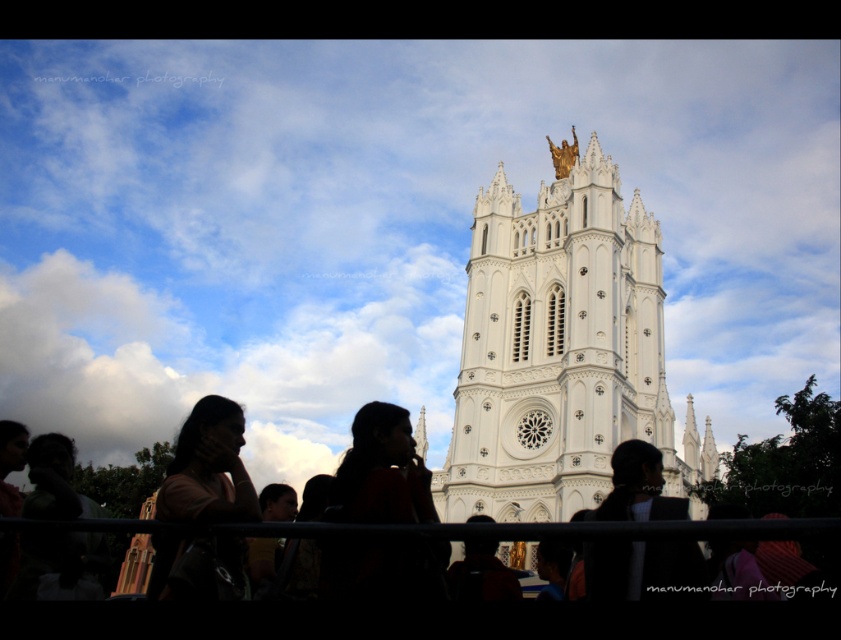
Question: Which point is closer to the camera?

Choices:
 (A) white stone tower at center
 (B) matte pink shirt at lower left
 (C) white stone spire at center

Answer: (B)

Question: Which point is closer to the camera taking this photo?

Choices:
 (A) click(x=56, y=470)
 (B) click(x=580, y=400)
 (C) click(x=218, y=467)

Answer: (C)

Question: Does matte pink shirt at lower left have a larger size compared to white stone spire at center?

Choices:
 (A) yes
 (B) no

Answer: (A)

Question: Which point is farther to the camera?

Choices:
 (A) dark brown leather backpack at center
 (B) dark red fabric at center
 (C) black fabric at center

Answer: (A)

Question: Is dark red fabric at center positioned before black fabric at center?

Choices:
 (A) yes
 (B) no

Answer: (B)

Question: Is white stone tower at center positioned behind matte pink shirt at lower left?

Choices:
 (A) no
 (B) yes

Answer: (B)